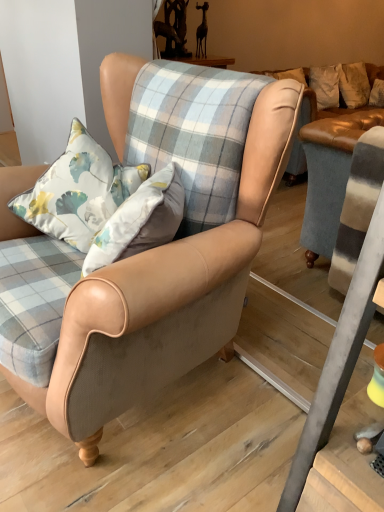
What do you see at coordinates (170, 265) in the screenshot?
I see `matte leather armchair at center` at bounding box center [170, 265].

Find the location of a particular element. This screenshot has height=512, width=384. matte leather armchair at center is located at coordinates (170, 265).

The width and height of the screenshot is (384, 512). Describe the element at coordinates (78, 191) in the screenshot. I see `floral fabric cushion at center` at that location.

Where is `floral fabric cushion at center`? The height and width of the screenshot is (512, 384). floral fabric cushion at center is located at coordinates (78, 191).

You are a GUI agent. You are given a task and a screenshot of the screen. Output one action in this format:
    pyautogui.click(x=<x>, y=<y>)
    Task: Click on the matte leather armchair at center
    This screenshot has height=512, width=384.
    Given the screenshot: What is the action you would take?
    pyautogui.click(x=170, y=265)

Which is more to the left, floral fabric cushion at center or matte leather armchair at center?

floral fabric cushion at center is more to the left.

Is floral fabric cushion at center in front of matte leather armchair at center?

No.

Is point (43, 184) behind point (153, 269)?

Yes.

From the image's perspective, does floral fabric cushion at center appear higher than matte leather armchair at center?

Yes.

From a real-world perspective, who is located higher, floral fabric cushion at center or matte leather armchair at center?

floral fabric cushion at center.

Is floral fabric cushion at center wider or thinner than matte leather armchair at center?

In the image, floral fabric cushion at center appears to be more narrow than matte leather armchair at center.

Can you confirm if floral fabric cushion at center is shorter than matte leather armchair at center?

Yes, floral fabric cushion at center is shorter than matte leather armchair at center.

Does floral fabric cushion at center have a larger size compared to matte leather armchair at center?

Incorrect, floral fabric cushion at center is not larger than matte leather armchair at center.

Can we say floral fabric cushion at center lies outside matte leather armchair at center?

No, floral fabric cushion at center is not entirely external to matte leather armchair at center.

Consider the image. Are floral fabric cushion at center and matte leather armchair at center making contact?

There is a gap between floral fabric cushion at center and matte leather armchair at center.

Is floral fabric cushion at center oriented towards matte leather armchair at center?

Yes, floral fabric cushion at center faces towards matte leather armchair at center.

Consider the image. Can you tell me how much floral fabric cushion at center and matte leather armchair at center differ in facing direction?

floral fabric cushion at center and matte leather armchair at center are facing 41 degrees away from each other.

At what (x,y) coordinates should I click in order to perform the action: click on chair below the floral fabric cushion at center (from the image's perspective). Please return your answer as a coordinate pair (x, y). Looking at the image, I should click on (170, 265).

Is matte leather armchair at center to the left or to the right of floral fabric cushion at center in the image?

Based on their positions, matte leather armchair at center is located to the right of floral fabric cushion at center.

Is the depth of matte leather armchair at center greater than that of floral fabric cushion at center?

That is False.

Which is farther, (72, 341) or (49, 206)?

Positioned behind is point (49, 206).

From the image's perspective, which one is positioned higher, matte leather armchair at center or floral fabric cushion at center?

floral fabric cushion at center appears higher in the image.

From a real-world perspective, is matte leather armchair at center below floral fabric cushion at center?

Correct, in the physical world, matte leather armchair at center is lower than floral fabric cushion at center.

Which of these two, matte leather armchair at center or floral fabric cushion at center, is thinner?

With smaller width is floral fabric cushion at center.

Is matte leather armchair at center taller or shorter than floral fabric cushion at center?

In the image, matte leather armchair at center appears to be taller than floral fabric cushion at center.

Which of these two, matte leather armchair at center or floral fabric cushion at center, is smaller?

floral fabric cushion at center is smaller.

Is matte leather armchair at center surrounding floral fabric cushion at center?

Absolutely, floral fabric cushion at center is inside matte leather armchair at center.

Would you say matte leather armchair at center is a long distance from floral fabric cushion at center?

No.

Is matte leather armchair at center looking in the opposite direction of floral fabric cushion at center?

Yes, matte leather armchair at center is facing away from floral fabric cushion at center.

How many degrees apart are the facing directions of matte leather armchair at center and floral fabric cushion at center?

The facing directions of matte leather armchair at center and floral fabric cushion at center are 41 degrees apart.

Where is `pillow behind the matte leather armchair at center`? pillow behind the matte leather armchair at center is located at coordinates point(78,191).

Where is `pillow behind the matte leather armchair at center`? pillow behind the matte leather armchair at center is located at coordinates (78, 191).

Image resolution: width=384 pixels, height=512 pixels. I want to click on chair in front of the floral fabric cushion at center, so click(x=170, y=265).